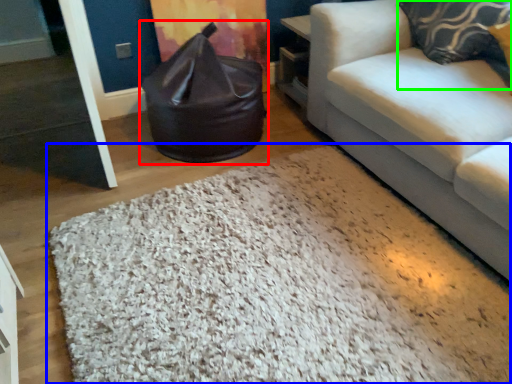
Question: Considering the real-world distances, which object is closest to bean bag chair (highlighted by a red box)? mat (highlighted by a blue box) or pillow (highlighted by a green box).

Choices:
 (A) mat
 (B) pillow

Answer: (A)